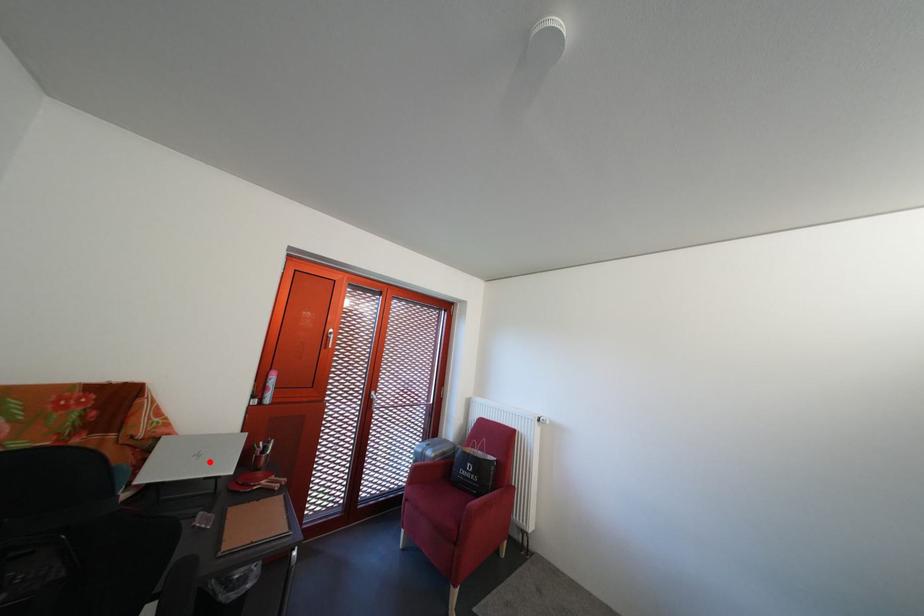
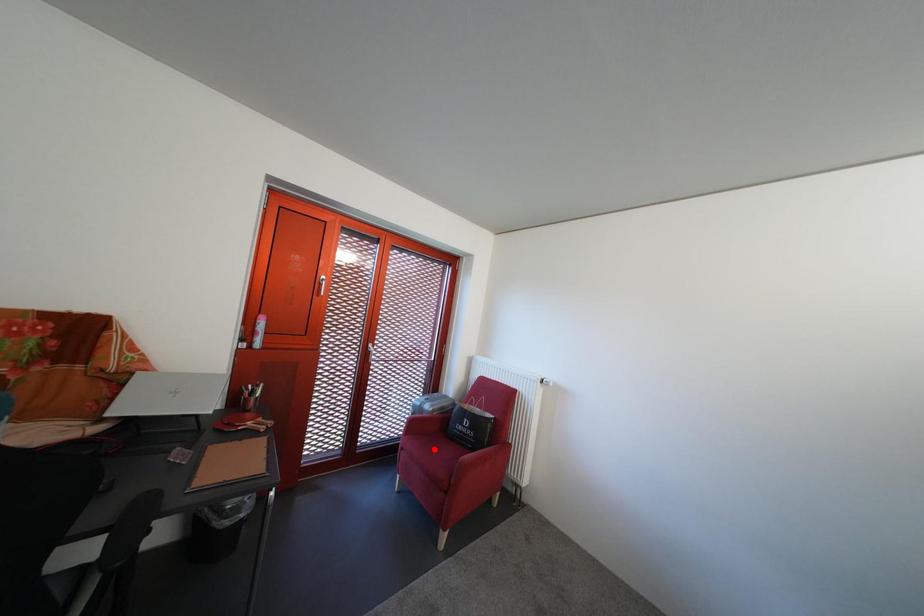
I am providing you with two images of the same scene from different viewpoints. A red point is marked on the first image and another point is marked on the second image. Are the points marked in image1 and image2 representing the same 3D position?

No